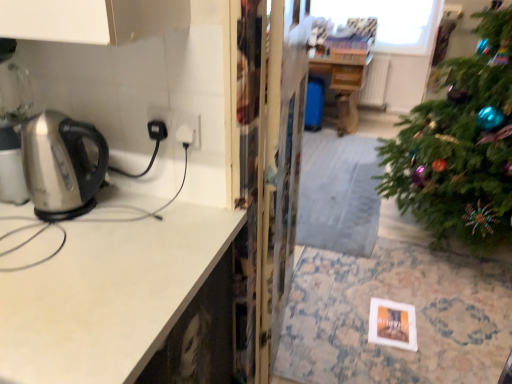
Question: Is metallic stainless steel kettle at left wider than transparent plastic screen door at center?

Choices:
 (A) yes
 (B) no

Answer: (A)

Question: Considering the relative positions of metallic stainless steel kettle at left and transparent plastic screen door at center in the image provided, is metallic stainless steel kettle at left to the right of transparent plastic screen door at center from the viewer's perspective?

Choices:
 (A) no
 (B) yes

Answer: (A)

Question: From the image's perspective, would you say metallic stainless steel kettle at left is shown under transparent plastic screen door at center?

Choices:
 (A) yes
 (B) no

Answer: (A)

Question: Does metallic stainless steel kettle at left have a greater height compared to transparent plastic screen door at center?

Choices:
 (A) yes
 (B) no

Answer: (A)

Question: Is metallic stainless steel kettle at left smaller than transparent plastic screen door at center?

Choices:
 (A) yes
 (B) no

Answer: (B)

Question: Is transparent plastic screen door at center completely or partially inside metallic stainless steel kettle at left?

Choices:
 (A) yes
 (B) no

Answer: (B)

Question: From a real-world perspective, does transparent plastic screen door at center sit lower than metallic stainless steel kettle at left?

Choices:
 (A) no
 (B) yes

Answer: (A)

Question: Considering the relative sizes of transparent plastic screen door at center and metallic stainless steel kettle at left in the image provided, is transparent plastic screen door at center bigger than metallic stainless steel kettle at left?

Choices:
 (A) no
 (B) yes

Answer: (A)

Question: Is transparent plastic screen door at center with metallic stainless steel kettle at left?

Choices:
 (A) no
 (B) yes

Answer: (A)

Question: Would you say transparent plastic screen door at center contains metallic stainless steel kettle at left?

Choices:
 (A) no
 (B) yes

Answer: (A)

Question: Is transparent plastic screen door at center outside metallic stainless steel kettle at left?

Choices:
 (A) yes
 (B) no

Answer: (A)

Question: Would you say transparent plastic screen door at center is a long distance from metallic stainless steel kettle at left?

Choices:
 (A) no
 (B) yes

Answer: (A)

Question: Can you confirm if metallic stainless steel kettle at left is smaller than satin white countertop at left?

Choices:
 (A) yes
 (B) no

Answer: (B)